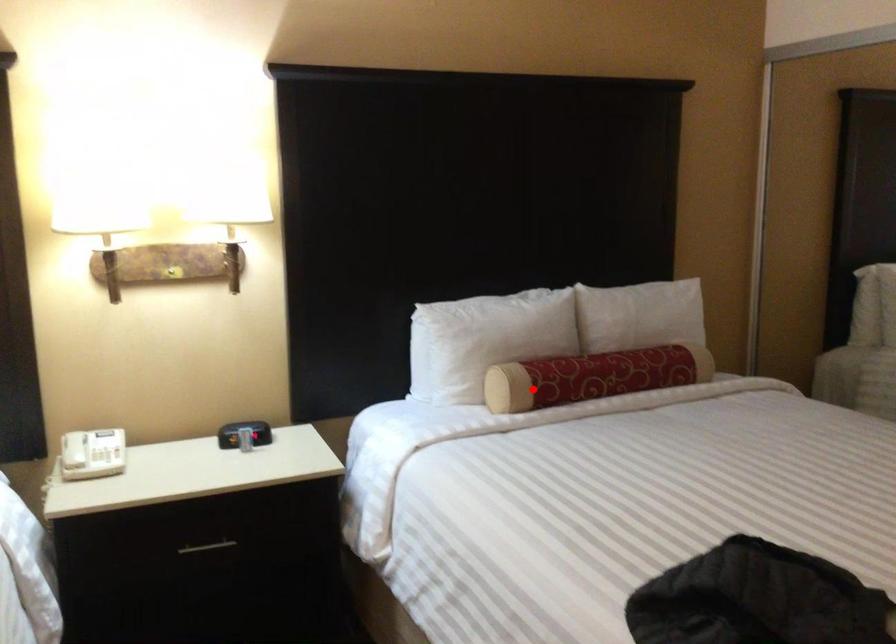
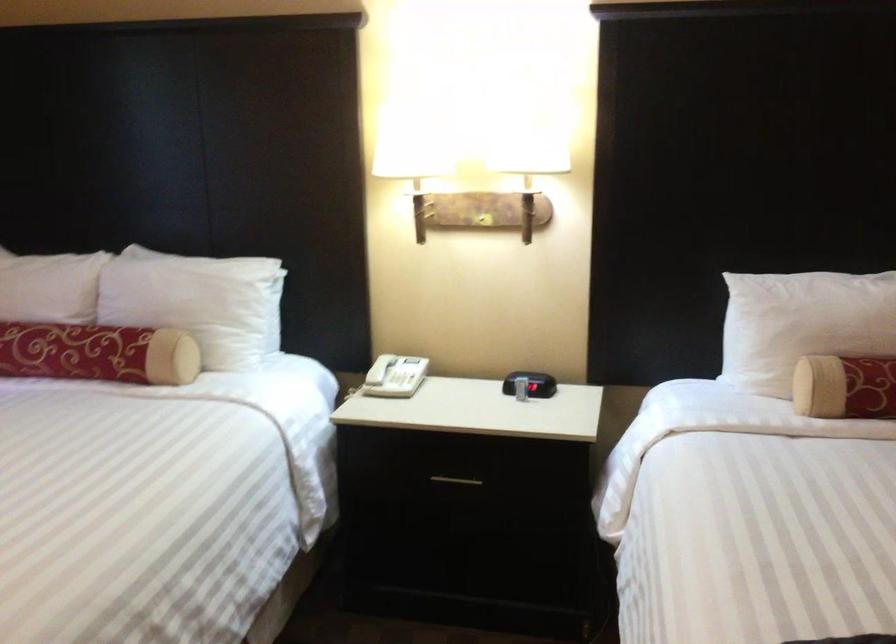
Where in the second image is the point corresponding to the highlighted location from the first image?

(845, 386)